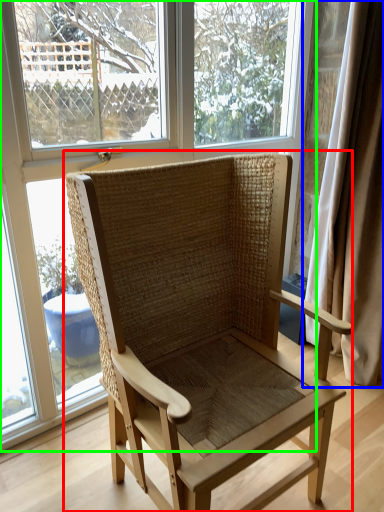
Question: Estimate the real-world distances between objects in this image. Which object is farther from chair (highlighted by a red box), curtain (highlighted by a blue box) or window (highlighted by a green box)?

Choices:
 (A) curtain
 (B) window

Answer: (A)